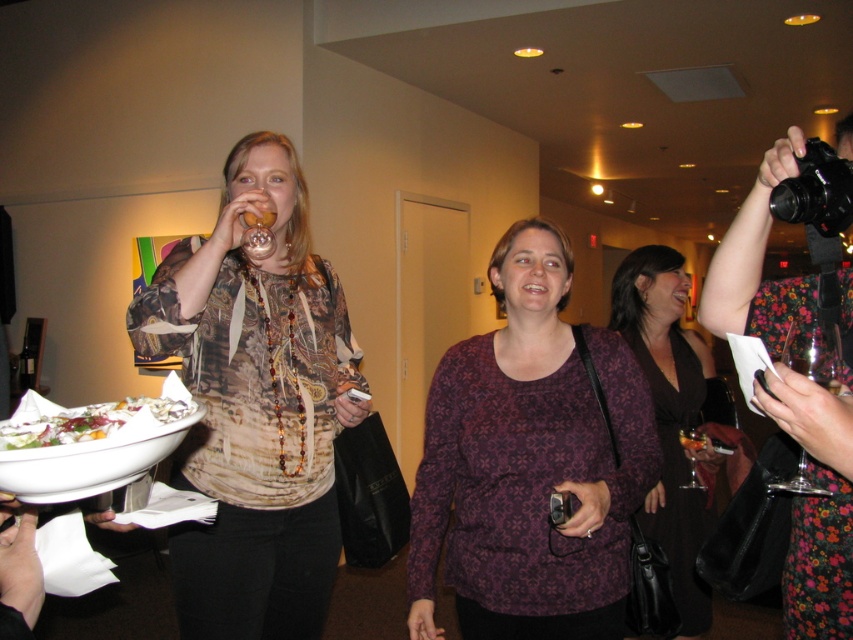
Question: Which object is closer to the camera taking this photo?

Choices:
 (A) purple printed shirt at center
 (B) floral-patterned dress at upper right

Answer: (B)

Question: Considering the relative positions of white ceramic platter at lower left and white glossy salad bowl at lower left in the image provided, where is white ceramic platter at lower left located with respect to white glossy salad bowl at lower left?

Choices:
 (A) below
 (B) above

Answer: (A)

Question: Is printed silk blouse at left wider than white glossy salad bowl at lower left?

Choices:
 (A) yes
 (B) no

Answer: (A)

Question: Is printed silk blouse at left positioned in front of white glossy salad bowl at lower left?

Choices:
 (A) no
 (B) yes

Answer: (A)

Question: Which object appears closest to the camera in this image?

Choices:
 (A) printed silk blouse at left
 (B) purple printed dress at center
 (C) white ceramic platter at lower left

Answer: (C)

Question: Which of the following is the farthest from the observer?

Choices:
 (A) (682, 352)
 (B) (33, 461)

Answer: (A)